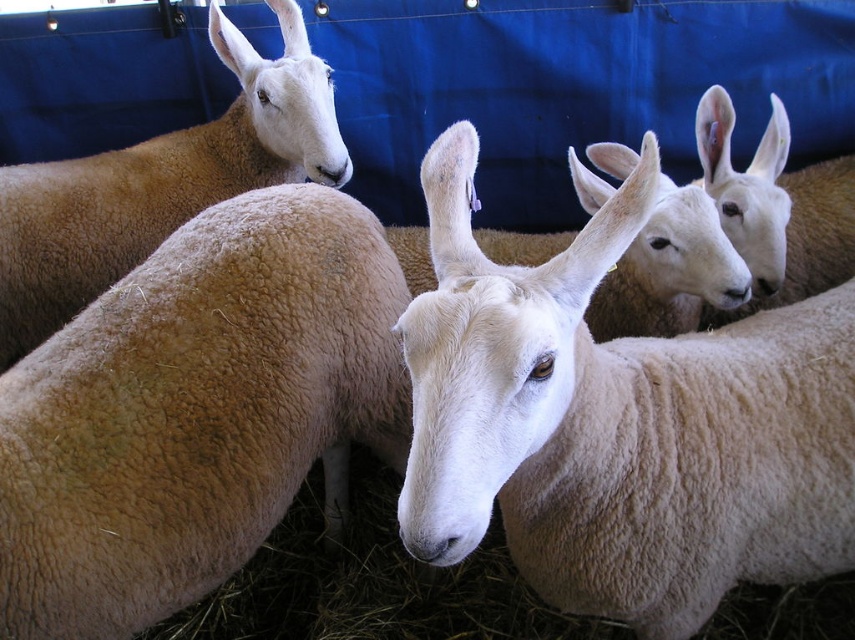
You are a farmer checking the distance between the sheep in the pen. You need to know if the light brown woolly sheep at left is closer than 4 feet to the white woolen sheep at upper right. Can you confirm?

The light brown woolly sheep at left is 3.34 feet from the white woolen sheep at upper right, so yes, it is closer than 4 feet.

You are a farmer checking the enclosure. You notice the white woolen goat at center and the light brown woolen sheep at left. Which animal is bigger?

The white woolen goat at center is larger in size compared to the light brown woolen sheep at left.

Based on the coordinates provided, which sheep is located at the point marked as (195, 412)?

The point marked at (195, 412) indicates the location of the light brown woolly sheep at left.